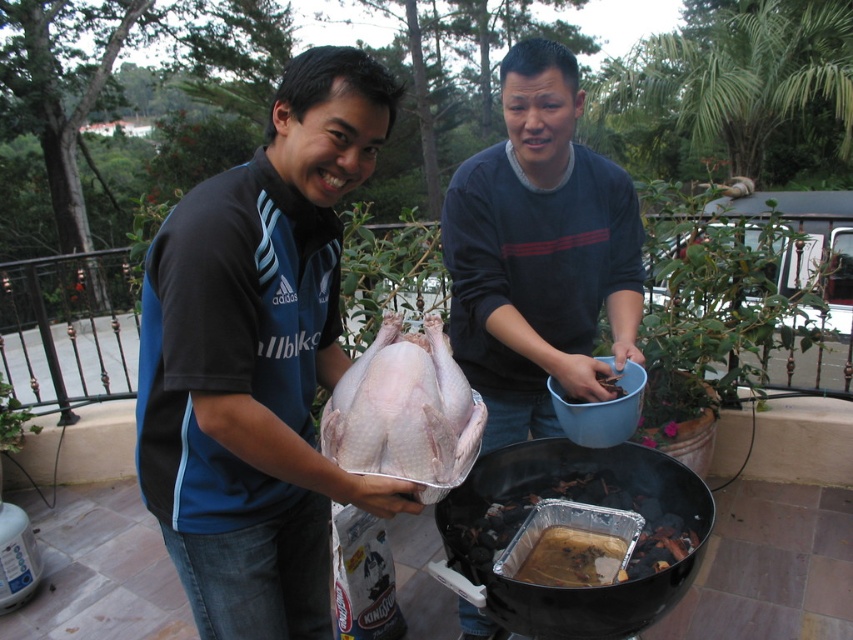
You are a chef preparing a meal and need to move a bowl of hot soup from the brown aluminum foil pan at lower center to the brown matte wood at center. Considering the distance between them, will the soup remain hot enough to serve by the time it reaches the destination?

The distance between the brown aluminum foil pan at lower center and the brown matte wood at center is 13.91 inches. Since the distance is relatively short, the soup should remain hot enough to serve after being moved.

In the scene shown: You are a photographer standing behind the two people in the image. You need to take a photo that clearly shows both the matte blue shirt at center and the dark blue sweater at center. Which person should you focus on first to ensure both are in focus?

You should focus on the matte blue shirt at center first because it is in front of the dark blue sweater at center, so focusing on the closer subject will help ensure both are in focus.

You are a delivery robot that is 14 inches wide. You need to move from the dark blue sweater at center to the brown aluminum foil pan at lower center. Is there enough space for you to pass through the gap between them?

The gap between the dark blue sweater at center and the brown aluminum foil pan at lower center is 15.30 inches. Since the robot is 14 inches wide, there is enough space for it to pass through the gap between them.